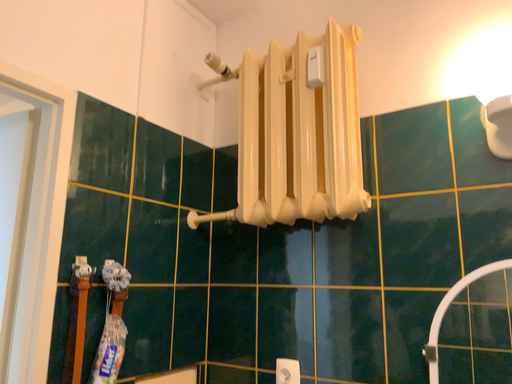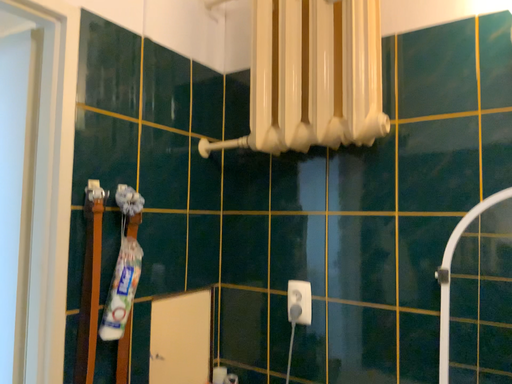
Question: How did the camera likely rotate when shooting the video?

Choices:
 (A) rotated downward
 (B) rotated upward

Answer: (A)